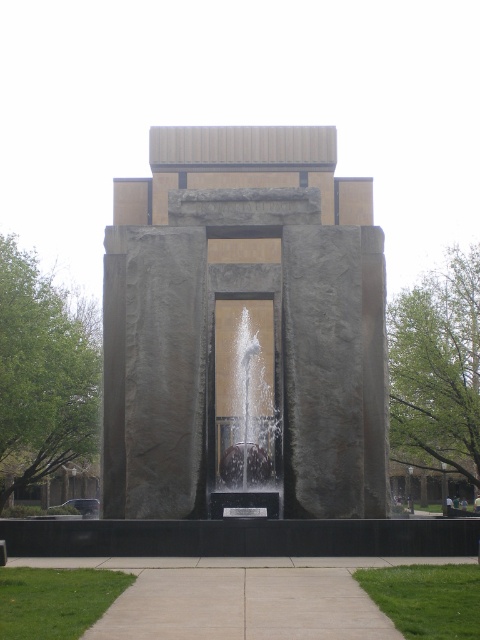
You are standing at the entrance of the park and want to find the gray stone fountain at center. According to the coordinates provided, in which direction should you walk to reach it?

The gray stone fountain at center is located at coordinates approximately 0.509 on the x and 0.517 on the y axis. Since these coordinates are close to the center point of the image, you should walk towards the middle of the park to reach it.